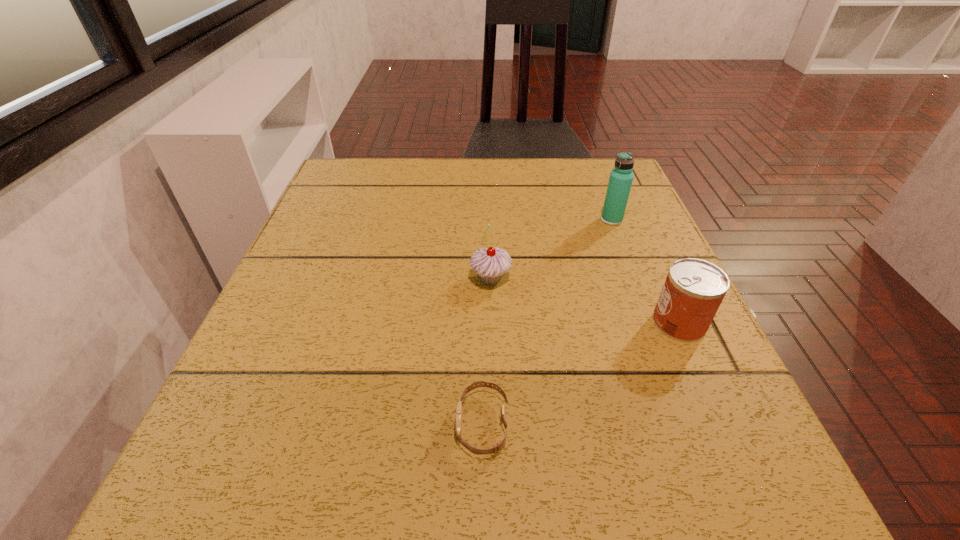
In order to click on free space at the near right corner of the desktop in this screenshot , I will do `click(679, 478)`.

In order to click on free space between the tallest object and the second nearest object in this screenshot , I will do `click(645, 271)`.

Image resolution: width=960 pixels, height=540 pixels. I want to click on vacant area that lies between the can and the cupcake, so click(x=585, y=301).

What are the coordinates of `vacant space in between the thermos bottle and the watch` in the screenshot? It's located at (547, 322).

Where is `vacant area between the thermos bottle and the watch`? The width and height of the screenshot is (960, 540). vacant area between the thermos bottle and the watch is located at coordinates [x=547, y=322].

Find the location of a particular element. This screenshot has width=960, height=540. vacant point located between the watch and the third farthest object is located at coordinates (581, 373).

Where is `empty space that is in between the third nearest object and the tallest object`? The width and height of the screenshot is (960, 540). empty space that is in between the third nearest object and the tallest object is located at coordinates (551, 249).

Find the location of a particular element. The image size is (960, 540). unoccupied position between the watch and the third nearest object is located at coordinates (487, 352).

The image size is (960, 540). I want to click on free space between the second farthest object and the thermos bottle, so click(551, 249).

Find the location of `vacant space that's between the nearest object and the tallest object`. vacant space that's between the nearest object and the tallest object is located at coordinates click(x=547, y=322).